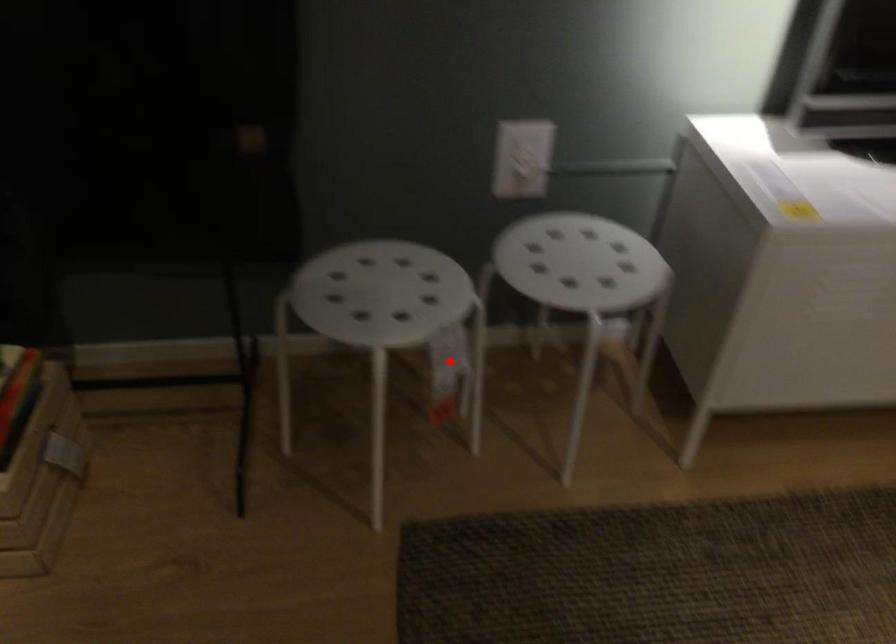
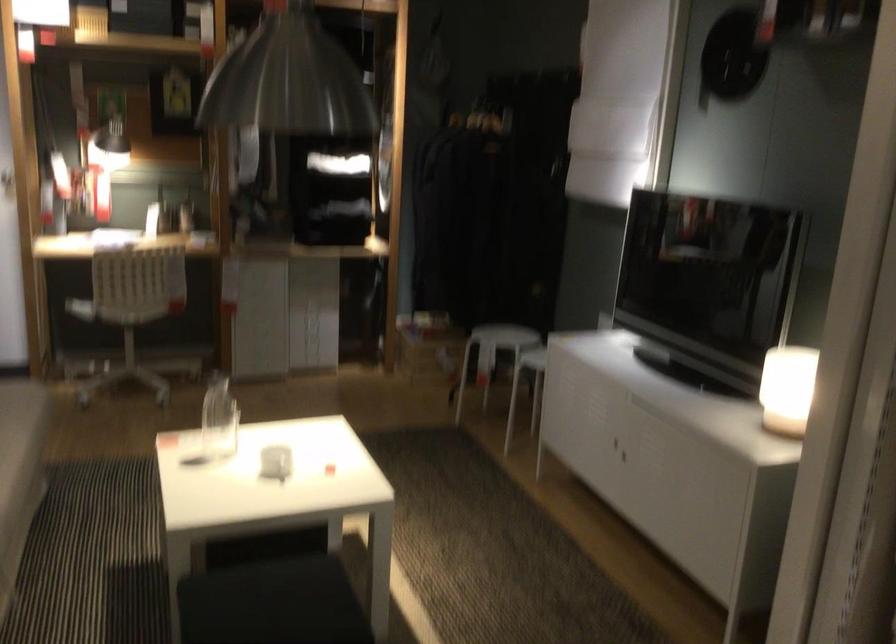
Where in the second image is the point corresponding to the highlighted location from the first image?

(492, 355)